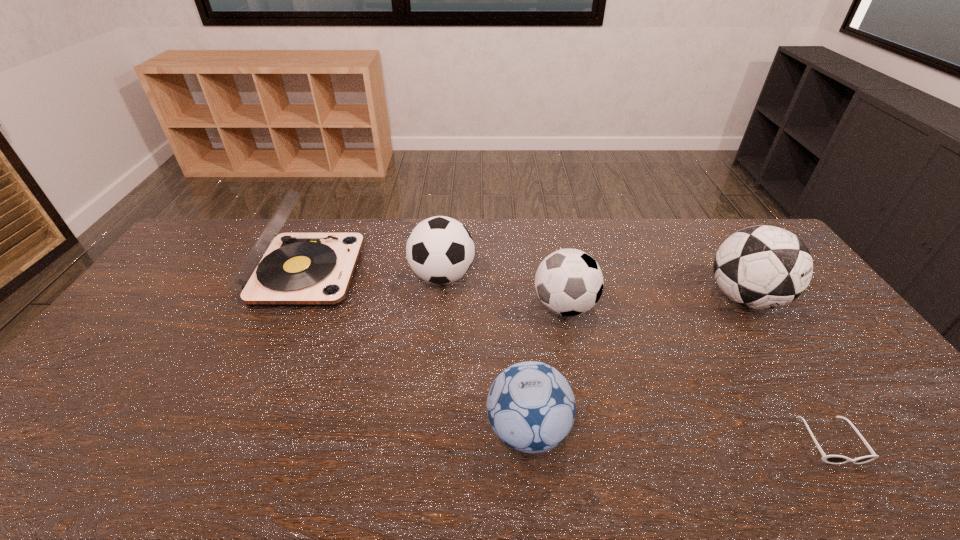
Locate an element on the screen. The width and height of the screenshot is (960, 540). the leftmost object is located at coordinates (291, 269).

Locate an element on the screen. the rightmost soccer ball is located at coordinates (762, 267).

Where is `the leftmost soccer ball`? The image size is (960, 540). the leftmost soccer ball is located at coordinates (440, 250).

The image size is (960, 540). In order to click on the nearest soccer ball in this screenshot , I will do [x=531, y=407].

You are a GUI agent. You are given a task and a screenshot of the screen. Output one action in this format:
    pyautogui.click(x=<x>, y=<y>)
    Task: Click on the shortest object
    The height and width of the screenshot is (540, 960).
    Given the screenshot: What is the action you would take?
    831,459

Image resolution: width=960 pixels, height=540 pixels. In order to click on vacant space located with the tonearm facing the front of the leftmost object in this screenshot , I will do `click(403, 273)`.

The height and width of the screenshot is (540, 960). I want to click on vacant area situated on the surface of the rightmost soccer ball where the brand logo is visible, so click(790, 368).

Find the location of a particular element. Image resolution: width=960 pixels, height=540 pixels. free region located 0.160m on the front of the leftmost soccer ball is located at coordinates (437, 336).

Identify the location of vacant region located on the side with brand of the nearest soccer ball. Image resolution: width=960 pixels, height=540 pixels. (387, 430).

Locate an element on the screen. Image resolution: width=960 pixels, height=540 pixels. free location located 0.070m on the side with brand of the nearest soccer ball is located at coordinates tap(457, 430).